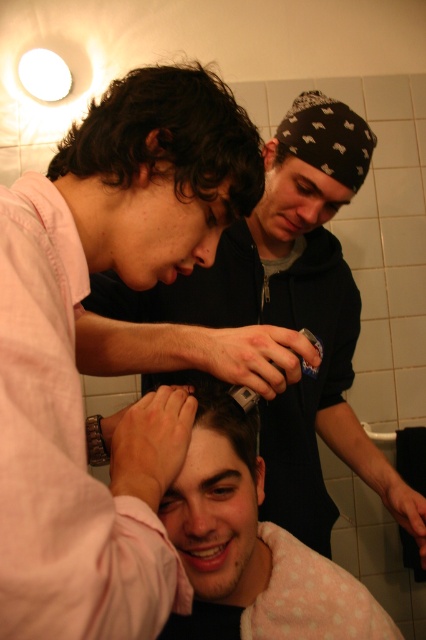
Can you confirm if matte black hair clipper at center is thinner than smooth skin head at center?

In fact, matte black hair clipper at center might be wider than smooth skin head at center.

Between matte black hair clipper at center and smooth skin head at center, which one is positioned higher?

matte black hair clipper at center is higher up.

At what (x,y) coordinates should I click in order to perform the action: click on matte black hair clipper at center. Please return your answer as a coordinate pair (x, y). The height and width of the screenshot is (640, 426). Looking at the image, I should click on (270, 317).

The width and height of the screenshot is (426, 640). Identify the location of matte black hair clipper at center. (270, 317).

Who is positioned more to the left, matte black hair clipper at center or dark curly hair at center?

From the viewer's perspective, dark curly hair at center appears more on the left side.

Which is more to the right, matte black hair clipper at center or dark curly hair at center?

Positioned to the right is matte black hair clipper at center.

Does point (319, 547) lie behind point (163, 225)?

Yes.

Identify the location of matte black hair clipper at center. The image size is (426, 640). (270, 317).

Is dark curly hair at center taller than smooth skin head at center?

Incorrect, dark curly hair at center's height is not larger of smooth skin head at center's.

Between dark curly hair at center and smooth skin head at center, which one has more height?

With more height is smooth skin head at center.

Who is more forward, (109, 141) or (235, 460)?

Point (109, 141) is in front.

This screenshot has height=640, width=426. Identify the location of dark curly hair at center. (158, 172).